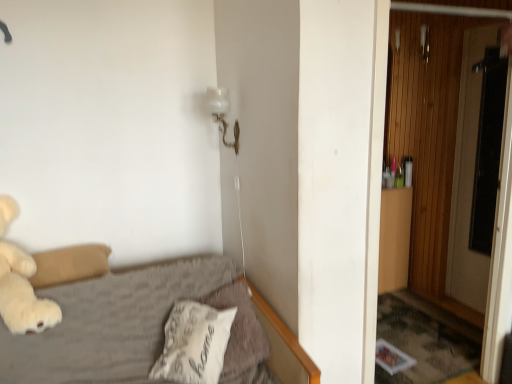
Question: Is white glass lamp at upper center wider or thinner than white soft pillow at lower center, the 2th pillow from the right?

Choices:
 (A) wide
 (B) thin

Answer: (B)

Question: From the image's perspective, is white glass lamp at upper center positioned above or below white soft pillow at lower center, the 1th pillow when ordered from left to right?

Choices:
 (A) above
 (B) below

Answer: (A)

Question: Which object is the farthest from the transparent glass screen door at right?

Choices:
 (A) white glass lamp at upper center
 (B) wooden at right
 (C) white plush teddy bear at left
 (D) white soft pillow at lower center, which appears as the second pillow when viewed from the left
 (E) white soft pillow at lower center, the 1th pillow when ordered from left to right

Answer: (C)

Question: Based on their relative distances, which object is nearer to the white plush teddy bear at left?

Choices:
 (A) transparent glass screen door at right
 (B) white soft pillow at lower center, the 1th pillow when ordered from left to right
 (C) wooden at right
 (D) white glass lamp at upper center
 (E) white soft pillow at lower center, which appears as the second pillow when viewed from the left

Answer: (B)